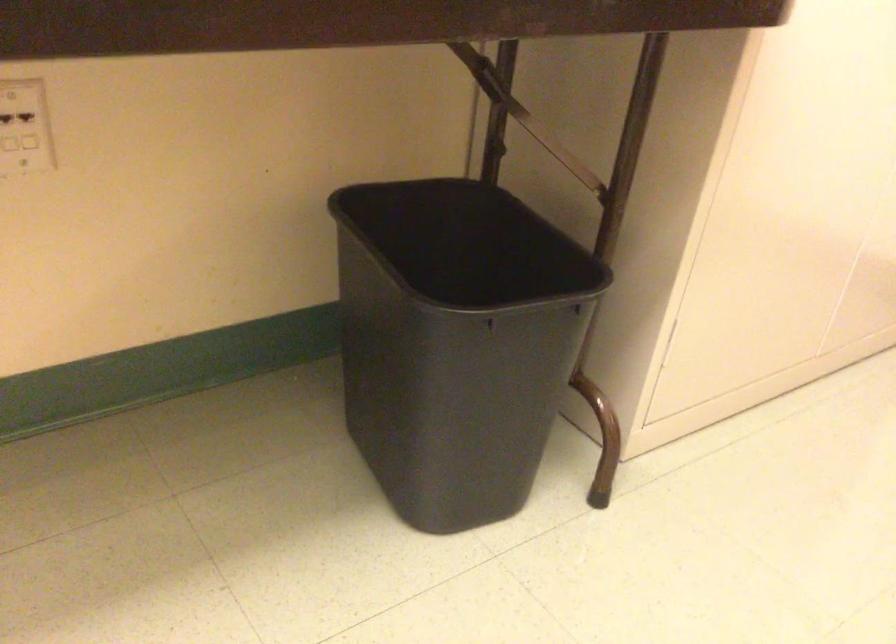
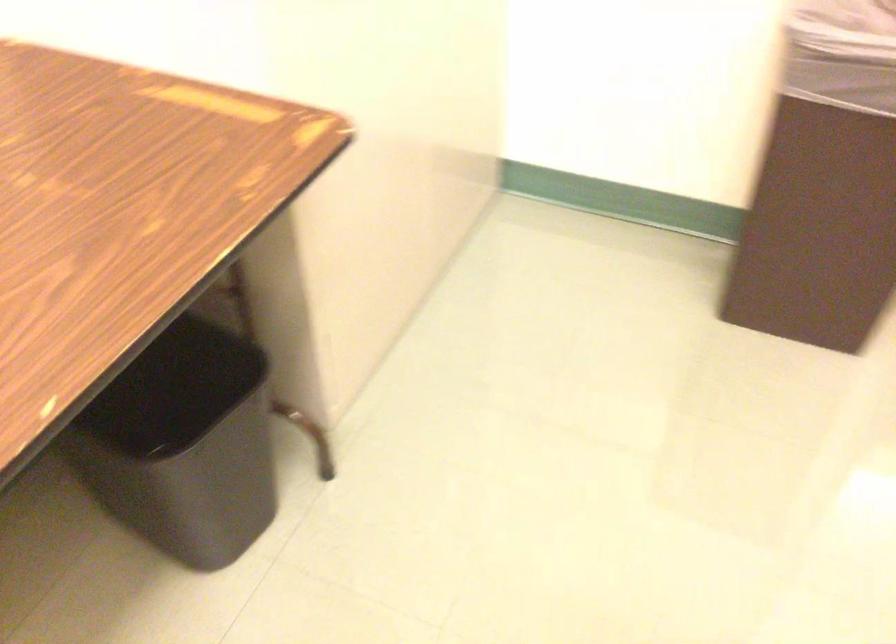
The point at [462,411] is marked in the first image. Where is the corresponding point in the second image?

(213, 489)